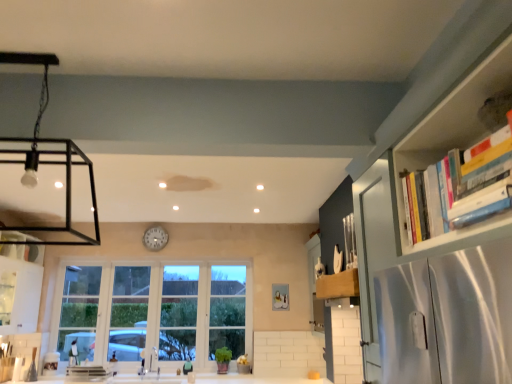
Locate an element on the screen. The width and height of the screenshot is (512, 384). clear glass window at center is located at coordinates (154, 311).

Locate an element on the screen. Image resolution: width=512 pixels, height=384 pixels. metallic silver sink at lower center is located at coordinates (87, 374).

Consider the image. From the image's perspective, which one is positioned higher, wooden knife block at upper right, which is the first cabinetry in right-to-left order, or matte black light fixture at upper left?

matte black light fixture at upper left is shown above in the image.

How different are the orientations of wooden knife block at upper right, which is the first cabinetry in right-to-left order, and matte black light fixture at upper left in degrees?

There is a 92-degree angle between the facing directions of wooden knife block at upper right, which is the first cabinetry in right-to-left order, and matte black light fixture at upper left.

Is wooden knife block at upper right, which is the first cabinetry in right-to-left order, touching matte black light fixture at upper left?

There is a gap between wooden knife block at upper right, which is the first cabinetry in right-to-left order, and matte black light fixture at upper left.

Who is shorter, wooden knife block at upper right, which is the first cabinetry in right-to-left order, or matte black light fixture at upper left?

wooden knife block at upper right, which is the first cabinetry in right-to-left order.

Can you tell me how much white glossy clock at center and wooden knife block at upper right, which is the first cabinetry in right-to-left order, differ in facing direction?

90 degrees separate the facing orientations of white glossy clock at center and wooden knife block at upper right, which is the first cabinetry in right-to-left order.

Is white glossy clock at center inside the boundaries of wooden knife block at upper right, which is the first cabinetry in right-to-left order, or outside?

white glossy clock at center cannot be found inside wooden knife block at upper right, which is the first cabinetry in right-to-left order.

Which object is more forward, white glossy clock at center or wooden knife block at upper right, which is counted as the second cabinetry, starting from the left?

wooden knife block at upper right, which is counted as the second cabinetry, starting from the left.

Can you confirm if white glossy clock at center is positioned to the left of wooden knife block at upper right, which is counted as the second cabinetry, starting from the left?

Yes, white glossy clock at center is to the left of wooden knife block at upper right, which is counted as the second cabinetry, starting from the left.

Is point (74, 380) closer to camera compared to point (39, 264)?

Yes, point (74, 380) is in front of point (39, 264).

From a real-world perspective, is metallic silver sink at lower center physically above white glossy cabinet at left, the second cabinetry from the right?

No, from a real-world perspective, metallic silver sink at lower center is not on top of white glossy cabinet at left, the second cabinetry from the right.

From the picture: Is metallic silver sink at lower center to the left or to the right of white glossy cabinet at left, the second cabinetry from the right, in the image?

metallic silver sink at lower center is to the right of white glossy cabinet at left, the second cabinetry from the right.

Is metallic silver sink at lower center positioned behind white glossy cabinet at left, the second cabinetry from the right?

Yes, the depth of metallic silver sink at lower center is greater than that of white glossy cabinet at left, the second cabinetry from the right.

Is hardcover books at upper right facing away from wooden knife block at upper right, which is the first cabinetry in right-to-left order?

No, hardcover books at upper right's orientation is not away from wooden knife block at upper right, which is the first cabinetry in right-to-left order.

Between hardcover books at upper right and wooden knife block at upper right, which is the first cabinetry in right-to-left order, which one is positioned in front?

Positioned in front is hardcover books at upper right.

Is hardcover books at upper right thinner than wooden knife block at upper right, which is counted as the second cabinetry, starting from the left?

In fact, hardcover books at upper right might be wider than wooden knife block at upper right, which is counted as the second cabinetry, starting from the left.

What's the angular difference between white glossy cabinet at left, placed as the 1th cabinetry when sorted from left to right, and hardcover books at upper right's facing directions?

178 degrees.

From the picture: Can you confirm if white glossy cabinet at left, the second cabinetry from the right, is taller than hardcover books at upper right?

Yes, white glossy cabinet at left, the second cabinetry from the right, is taller than hardcover books at upper right.

Is white glossy cabinet at left, the second cabinetry from the right, further to camera compared to hardcover books at upper right?

Yes, white glossy cabinet at left, the second cabinetry from the right, is behind hardcover books at upper right.

In terms of size, does white glossy cabinet at left, the second cabinetry from the right, appear bigger or smaller than hardcover books at upper right?

In the image, white glossy cabinet at left, the second cabinetry from the right, appears to be larger than hardcover books at upper right.

Who is more distant, white glossy cabinet at left, placed as the 1th cabinetry when sorted from left to right, or clear glass window at center?

clear glass window at center is further from the camera.

Is point (23, 274) positioned behind point (108, 314)?

No.

Looking at this image, from the image's perspective, which one is positioned lower, white glossy cabinet at left, the second cabinetry from the right, or clear glass window at center?

clear glass window at center appears lower in the image.

In terms of height, does white glossy cabinet at left, the second cabinetry from the right, look taller or shorter compared to clear glass window at center?

In the image, white glossy cabinet at left, the second cabinetry from the right, appears to be shorter than clear glass window at center.

Which is more to the right, white glossy cabinet at left, placed as the 1th cabinetry when sorted from left to right, or wooden knife block at upper right, which is counted as the second cabinetry, starting from the left?

wooden knife block at upper right, which is counted as the second cabinetry, starting from the left, is more to the right.

Based on the photo, considering their positions, is white glossy cabinet at left, placed as the 1th cabinetry when sorted from left to right, located in front of or behind wooden knife block at upper right, which is counted as the second cabinetry, starting from the left?

white glossy cabinet at left, placed as the 1th cabinetry when sorted from left to right, is behind wooden knife block at upper right, which is counted as the second cabinetry, starting from the left.

Is white glossy cabinet at left, placed as the 1th cabinetry when sorted from left to right, oriented away from wooden knife block at upper right, which is counted as the second cabinetry, starting from the left?

No, wooden knife block at upper right, which is counted as the second cabinetry, starting from the left, is not at the back of white glossy cabinet at left, placed as the 1th cabinetry when sorted from left to right.

From a real-world perspective, is white glossy cabinet at left, placed as the 1th cabinetry when sorted from left to right, over wooden knife block at upper right, which is counted as the second cabinetry, starting from the left?

Indeed, from a real-world perspective, white glossy cabinet at left, placed as the 1th cabinetry when sorted from left to right, stands above wooden knife block at upper right, which is counted as the second cabinetry, starting from the left.

Identify the location of light fixture on the left of wooden knife block at upper right, which is counted as the second cabinetry, starting from the left. (51, 151).

Identify the location of cabinetry that is on the right side of white glossy clock at center. (338, 285).

Based on their spatial positions, is hardcover books at upper right or white glossy clock at center further from metallic silver sink at lower center?

hardcover books at upper right lies further to metallic silver sink at lower center than the other object.

From the image, which object appears to be farther from clear glass window at center, matte black light fixture at upper left or white glossy clock at center?

matte black light fixture at upper left is further to clear glass window at center.

Considering their positions, is matte black light fixture at upper left positioned further to white glossy cabinet at left, placed as the 1th cabinetry when sorted from left to right, than metallic silver sink at lower center?

metallic silver sink at lower center is positioned further to the anchor white glossy cabinet at left, placed as the 1th cabinetry when sorted from left to right.

When comparing their distances from matte black light fixture at upper left, does metallic silver sink at lower center or white glossy clock at center seem further?

metallic silver sink at lower center is positioned further to the anchor matte black light fixture at upper left.

When comparing their distances from wooden knife block at upper right, which is the first cabinetry in right-to-left order, does matte black light fixture at upper left or white glossy cabinet at left, the second cabinetry from the right, seem closer?

The object closer to wooden knife block at upper right, which is the first cabinetry in right-to-left order, is matte black light fixture at upper left.

Estimate the real-world distances between objects in this image. Which object is further from clear glass window at center, white glossy cabinet at left, placed as the 1th cabinetry when sorted from left to right, or wooden knife block at upper right, which is the first cabinetry in right-to-left order?

wooden knife block at upper right, which is the first cabinetry in right-to-left order, is further to clear glass window at center.

Looking at the image, which one is located further to metallic silver sink at lower center, matte black light fixture at upper left or clear glass window at center?

matte black light fixture at upper left.

From the image, which object appears to be nearer to metallic silver sink at lower center, white glossy cabinet at left, placed as the 1th cabinetry when sorted from left to right, or matte black light fixture at upper left?

white glossy cabinet at left, placed as the 1th cabinetry when sorted from left to right.

Find the location of a particular element. appliance between white glossy cabinet at left, placed as the 1th cabinetry when sorted from left to right, and white glossy clock at center, in the horizontal direction is located at coordinates (87, 374).

Locate an element on the screen. cabinetry located between white glossy cabinet at left, placed as the 1th cabinetry when sorted from left to right, and hardcover books at upper right in the left-right direction is located at coordinates [x=338, y=285].

Image resolution: width=512 pixels, height=384 pixels. I want to click on light fixture located between hardcover books at upper right and white glossy clock at center in the depth direction, so (x=51, y=151).

Find the location of a particular element. This screenshot has width=512, height=384. clock between white glossy cabinet at left, the second cabinetry from the right, and wooden knife block at upper right, which is counted as the second cabinetry, starting from the left, in the horizontal direction is located at coordinates (155, 238).